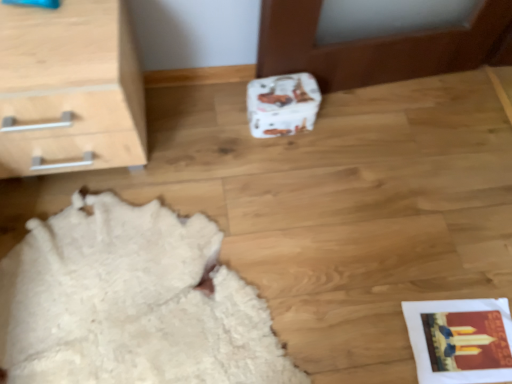
I want to click on unoccupied area in front of white paper shoe box at center, so click(x=279, y=162).